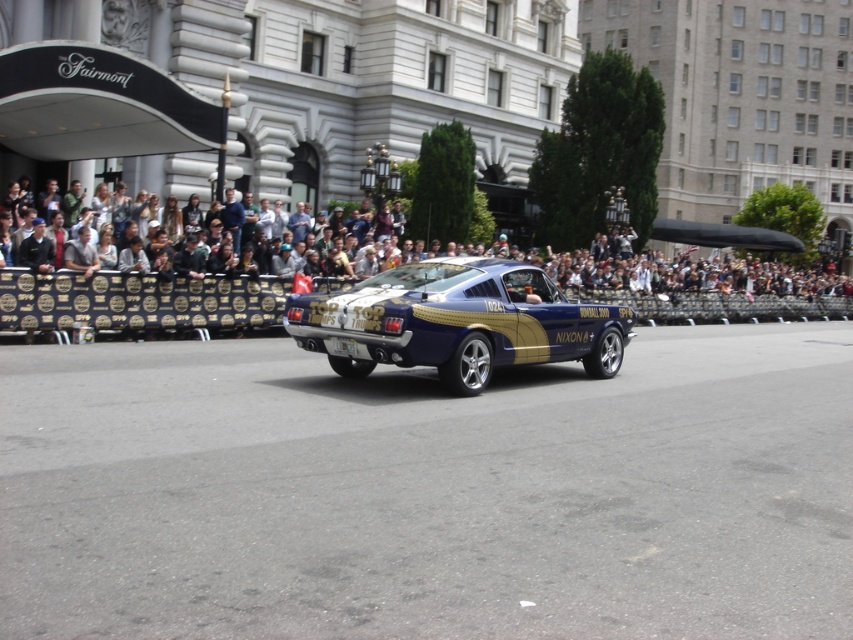
Question: Which of these objects is positioned closest to the shiny metallic car at center?

Choices:
 (A) dark gray crowd at upper center
 (B) smooth asphalt road at center

Answer: (B)

Question: Does smooth asphalt road at center have a lesser width compared to shiny metallic car at center?

Choices:
 (A) yes
 (B) no

Answer: (B)

Question: Is smooth asphalt road at center thinner than shiny metallic car at center?

Choices:
 (A) yes
 (B) no

Answer: (B)

Question: Does smooth asphalt road at center have a lesser width compared to dark gray crowd at upper center?

Choices:
 (A) yes
 (B) no

Answer: (A)

Question: Which point is farther to the camera?

Choices:
 (A) (788, 268)
 (B) (413, 620)

Answer: (A)

Question: Which of these objects is positioned farthest from the smooth asphalt road at center?

Choices:
 (A) shiny metallic car at center
 (B) dark gray crowd at upper center

Answer: (B)